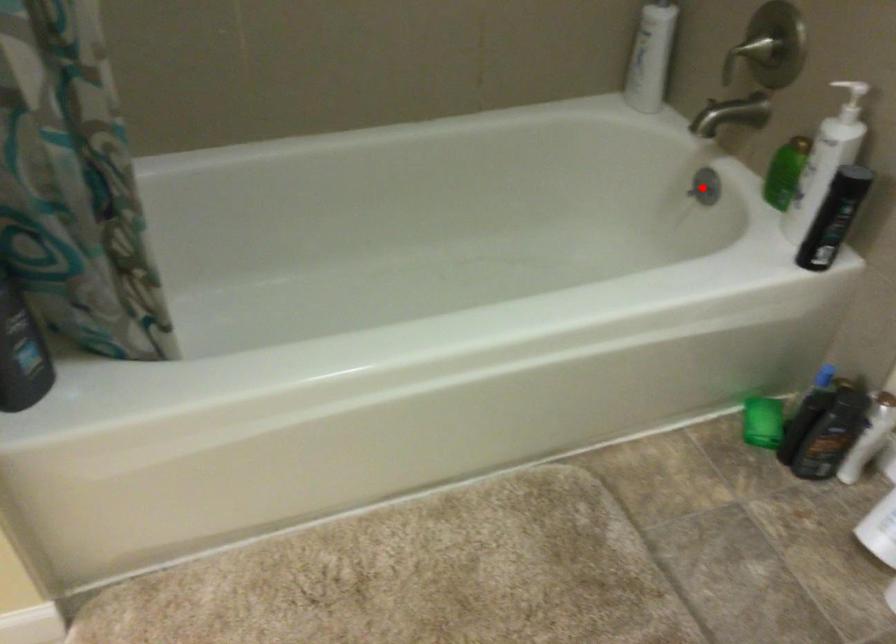
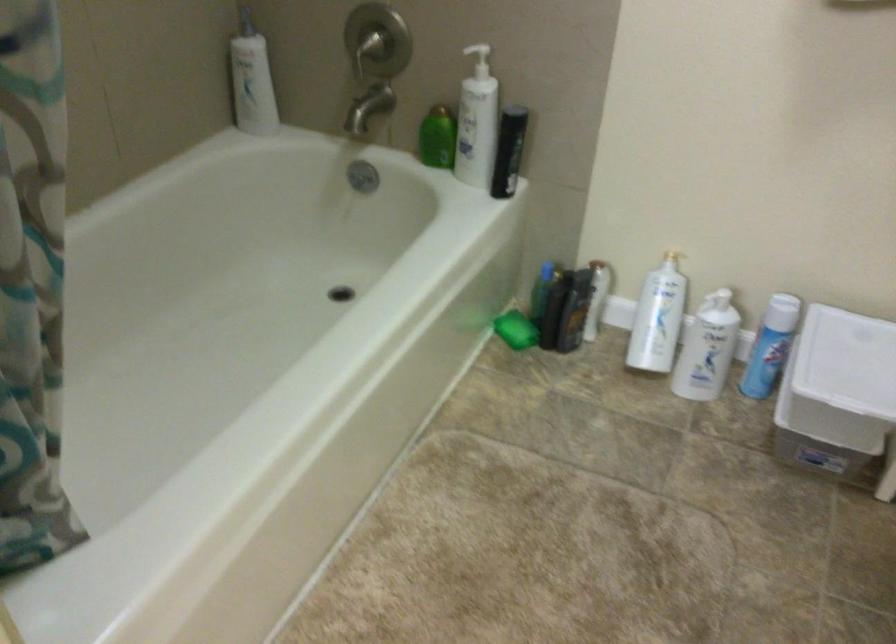
Question: I am providing you with two images of the same scene from different viewpoints. A red point is shown in image1. For the corresponding object point in image2, is it positioned nearer or farther from the camera?

Choices:
 (A) Nearer
 (B) Farther

Answer: (B)